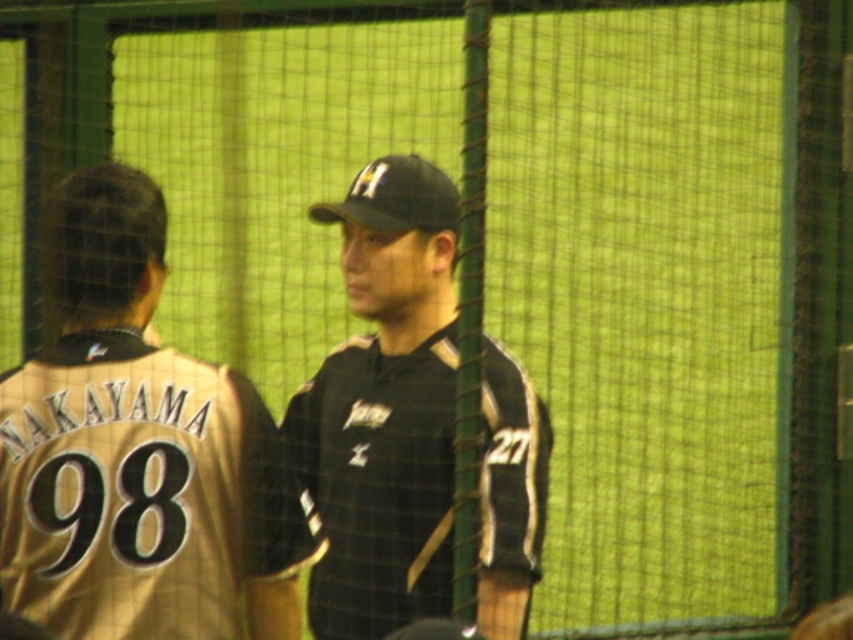
Question: Does gold jersey at left appear over black matte baseball cap at center?

Choices:
 (A) no
 (B) yes

Answer: (A)

Question: Can you confirm if gold jersey at left is positioned above black matte baseball cap at center?

Choices:
 (A) yes
 (B) no

Answer: (B)

Question: Which of the following is the farthest from the observer?

Choices:
 (A) gold jersey at left
 (B) black matte uniform at center
 (C) black matte baseball cap at center

Answer: (C)

Question: Among these points, which one is nearest to the camera?

Choices:
 (A) (381, 202)
 (B) (131, 353)
 (C) (322, 212)

Answer: (B)

Question: Is gold jersey at left closer to camera compared to black matte uniform at center?

Choices:
 (A) yes
 (B) no

Answer: (A)

Question: Which object is the closest to the gold jersey at left?

Choices:
 (A) black matte uniform at center
 (B) black matte baseball cap at center

Answer: (A)